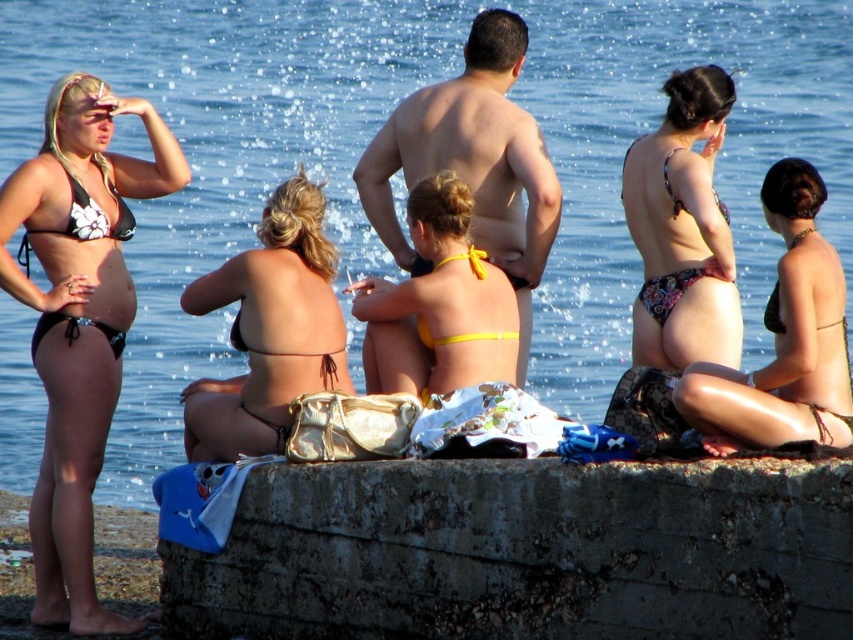
Is matte black skin at center wider than white floral bikini top at left?

Correct, the width of matte black skin at center exceeds that of white floral bikini top at left.

Who is higher up, matte black skin at center or white floral bikini top at left?

Positioned higher is matte black skin at center.

Is point (463, 177) positioned before point (120, 230)?

No, it is behind (120, 230).

At what (x,y) coordinates should I click in order to perform the action: click on matte black skin at center. Please return your answer as a coordinate pair (x, y). The width and height of the screenshot is (853, 640). Looking at the image, I should click on (473, 163).

Which is above, matte black skin at center or brown fabric bikini at center?

Positioned higher is matte black skin at center.

Which is below, matte black skin at center or brown fabric bikini at center?

Positioned lower is brown fabric bikini at center.

Is point (450, 131) positioned behind point (280, 429)?

Yes, it is behind point (280, 429).

Find the location of a particular element. matte black skin at center is located at coordinates (473, 163).

Does rusty concrete wall at lower center appear under brown fabric bikini at center?

Yes.

Image resolution: width=853 pixels, height=640 pixels. In order to click on rusty concrete wall at lower center in this screenshot , I will do `click(525, 552)`.